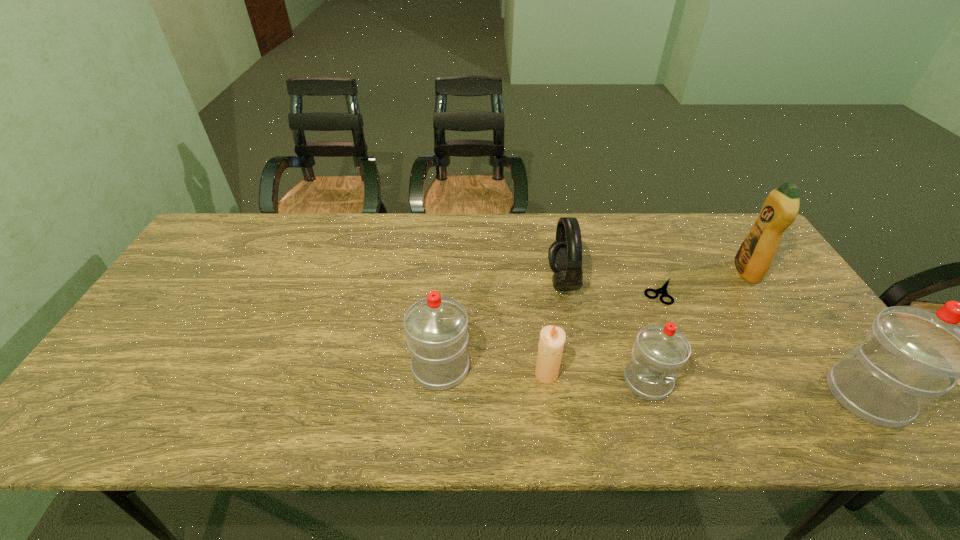
Please point a free position for a water bottle on the left. Please provide its 2D coordinates. Your answer should be formatted as a tuple, i.e. [(x, y)], where the tuple contains the x and y coordinates of a point satisfying the conditions above.

[(245, 354)]